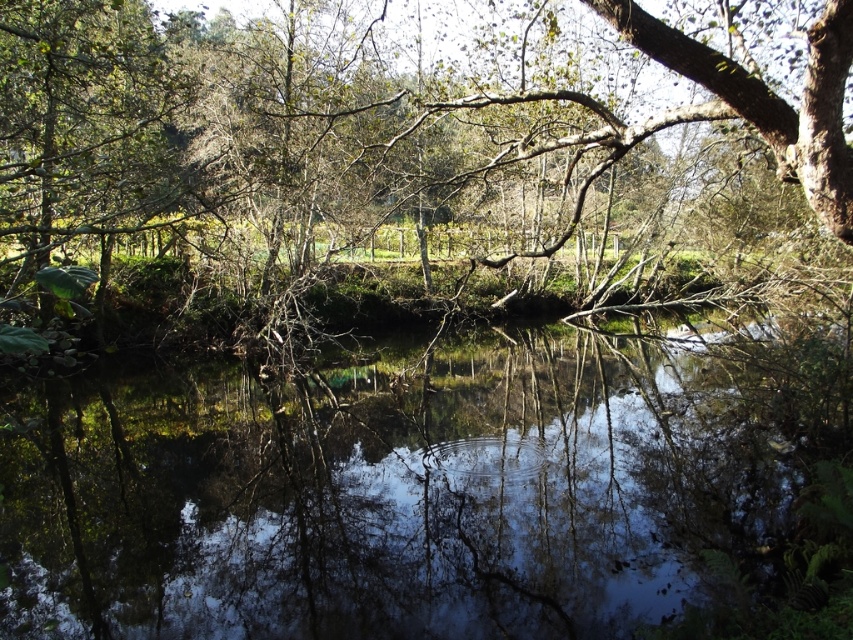
Question: Which point is farther to the camera?

Choices:
 (A) (438, 406)
 (B) (552, 51)

Answer: (A)

Question: Is the position of transparent water at center more distant than that of green leafy tree at upper center?

Choices:
 (A) no
 (B) yes

Answer: (A)

Question: Does transparent water at center appear on the left side of green leafy tree at upper center?

Choices:
 (A) no
 (B) yes

Answer: (B)

Question: Does transparent water at center come behind green leafy tree at upper center?

Choices:
 (A) no
 (B) yes

Answer: (A)

Question: Which object is closer to the camera taking this photo?

Choices:
 (A) green leafy tree at upper center
 (B) transparent water at center

Answer: (B)